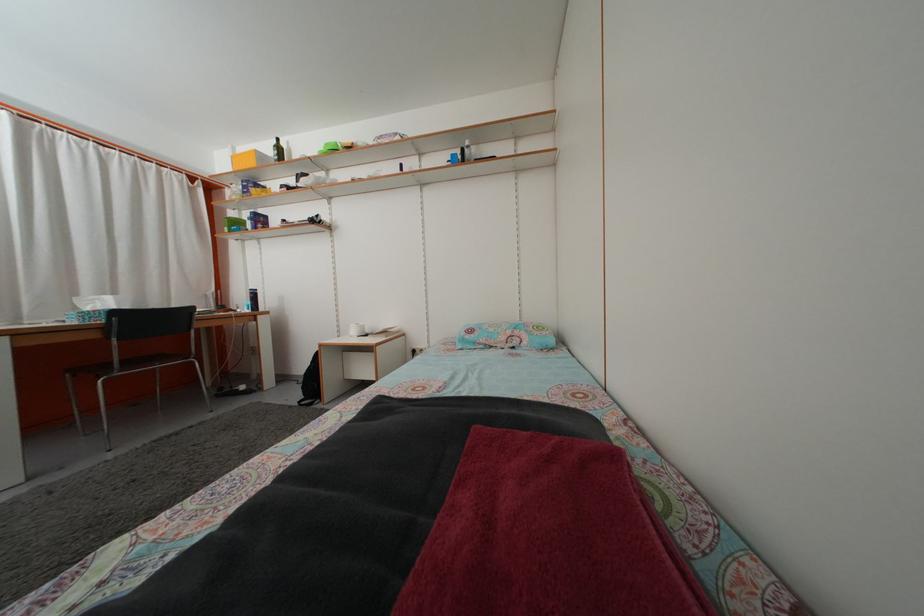
The image size is (924, 616). I want to click on yellow cardboard box, so click(244, 160).